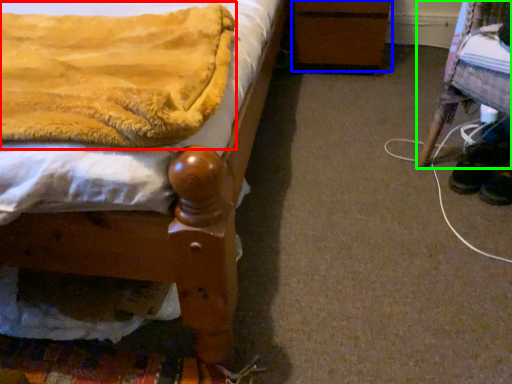
Question: Which is nearer to the blanket (highlighted by a red box)? changing table (highlighted by a blue box) or furniture (highlighted by a green box).

Choices:
 (A) changing table
 (B) furniture

Answer: (B)